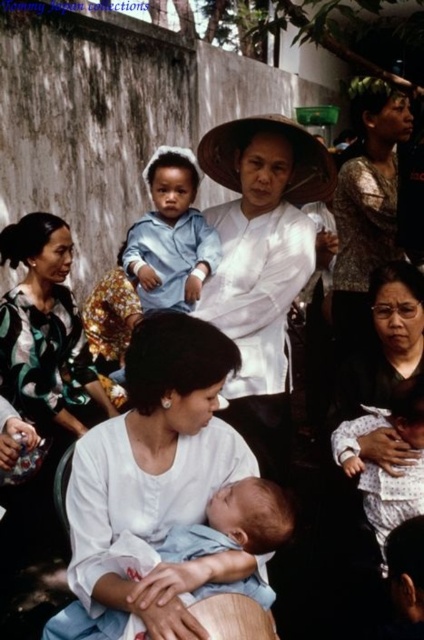
You are a photographer trying to capture a candid shot of the two white objects at the center of the scene. Given that your camera has a minimum focus distance of 90 centimeters, will you be able to focus on both the white cotton shirt at center and the white matte hat at center simultaneously?

The white cotton shirt at center and white matte hat at center are 89.47 centimeters apart from each other. Since the distance between them is less than the camera minimum focus distance of 90 centimeters, you cannot focus on both simultaneously.

You are a photographer at the event and want to capture a photo of the white cotton shirt at center and the white matte hat at center. Which object is closer to the camera?

The white cotton shirt at center is positioned under the white matte hat at center, so the white cotton shirt at center is closer to the camera.